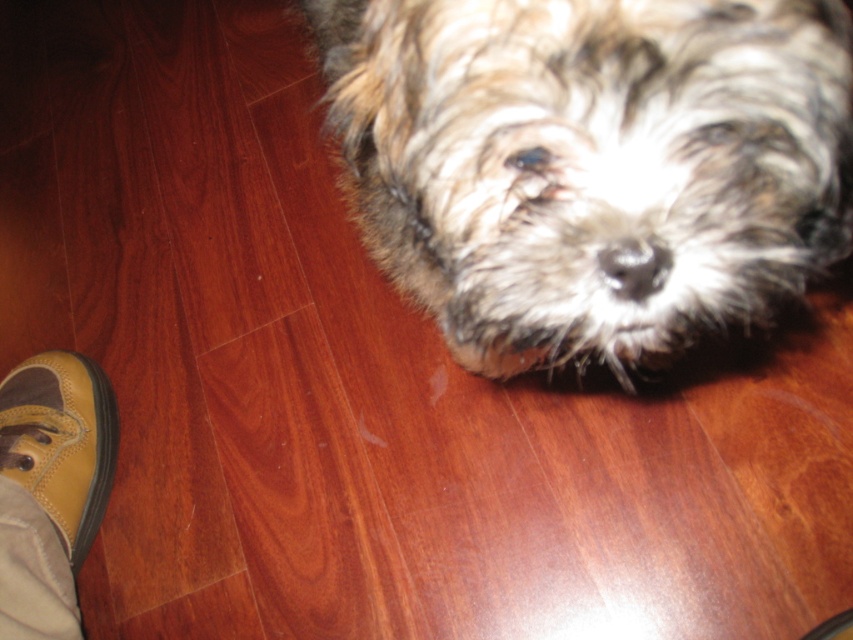
Question: Is fuzzy brown dog at center below tan suede shoe at lower left?

Choices:
 (A) yes
 (B) no

Answer: (B)

Question: Can you confirm if fuzzy brown dog at center is positioned to the right of tan suede shoe at lower left?

Choices:
 (A) yes
 (B) no

Answer: (A)

Question: Among these objects, which one is farthest from the camera?

Choices:
 (A) fuzzy brown dog at center
 (B) tan suede shoe at lower left

Answer: (B)

Question: Can you confirm if fuzzy brown dog at center is wider than tan suede shoe at lower left?

Choices:
 (A) yes
 (B) no

Answer: (A)

Question: Which point is farther to the camera?

Choices:
 (A) tan suede shoe at lower left
 (B) fuzzy brown dog at center

Answer: (A)